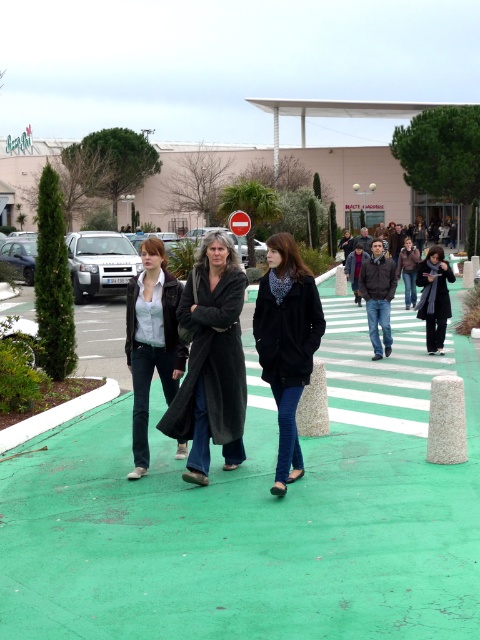
Between matte black jacket at center and dark gray coat at center, which one has less height?

matte black jacket at center

Does point (160, 244) lie in front of point (454, 280)?

That is True.

Which is behind, point (166, 380) or point (448, 280)?

Point (448, 280)

The height and width of the screenshot is (640, 480). I want to click on matte black jacket at center, so click(x=152, y=340).

Is point (225, 376) positioned in front of point (279, 307)?

No, (225, 376) is behind (279, 307).

Who is positioned more to the right, dark gray wool coat at center or black matte coat at center?

From the viewer's perspective, black matte coat at center appears more on the right side.

This screenshot has height=640, width=480. I want to click on dark gray wool coat at center, so click(x=211, y=362).

Is point (446, 592) less distant than point (265, 340)?

Yes, it is in front of point (265, 340).

Consider the image. Is green rubber pavement at center to the right of black matte coat at center from the viewer's perspective?

In fact, green rubber pavement at center is to the left of black matte coat at center.

Locate an element on the screen. The image size is (480, 640). green rubber pavement at center is located at coordinates (247, 529).

Identify the location of green rubber pavement at center. Image resolution: width=480 pixels, height=640 pixels. pos(247,529).